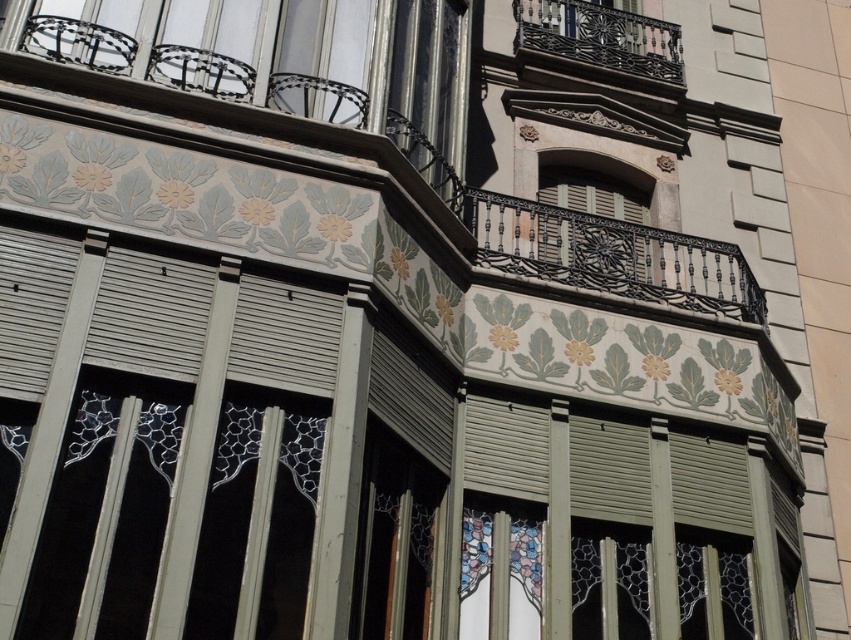
Between black wrought iron balcony at center and dark brown wrought iron balcony at upper center, which one is positioned lower?

black wrought iron balcony at center

Does black wrought iron balcony at center have a greater height compared to dark brown wrought iron balcony at upper center?

No.

Who is more forward, (643, 248) or (566, 65)?

Point (643, 248) is more forward.

Where is `black wrought iron balcony at center`? This screenshot has width=851, height=640. black wrought iron balcony at center is located at coordinates (609, 253).